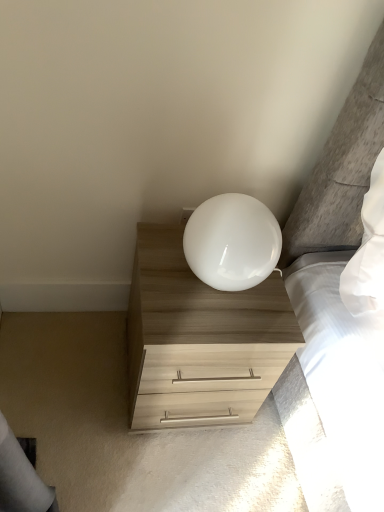
Question: Considering their positions, is light wood/texture chest of drawers at lower right located in front of or behind white glossy lamp at upper center?

Choices:
 (A) behind
 (B) front

Answer: (A)

Question: Is light wood/texture chest of drawers at lower right to the left or to the right of white glossy lamp at upper center in the image?

Choices:
 (A) left
 (B) right

Answer: (A)

Question: Is light wood/texture chest of drawers at lower right bigger or smaller than white glossy lamp at upper center?

Choices:
 (A) small
 (B) big

Answer: (B)

Question: From a real-world perspective, is white glossy lamp at upper center above or below light wood/texture chest of drawers at lower right?

Choices:
 (A) below
 (B) above

Answer: (B)

Question: In terms of height, does white glossy lamp at upper center look taller or shorter compared to light wood/texture chest of drawers at lower right?

Choices:
 (A) tall
 (B) short

Answer: (B)

Question: Do you think white glossy lamp at upper center is within light wood/texture chest of drawers at lower right, or outside of it?

Choices:
 (A) inside
 (B) outside

Answer: (B)

Question: Is white glossy lamp at upper center to the left or to the right of light wood/texture chest of drawers at lower right in the image?

Choices:
 (A) left
 (B) right

Answer: (B)